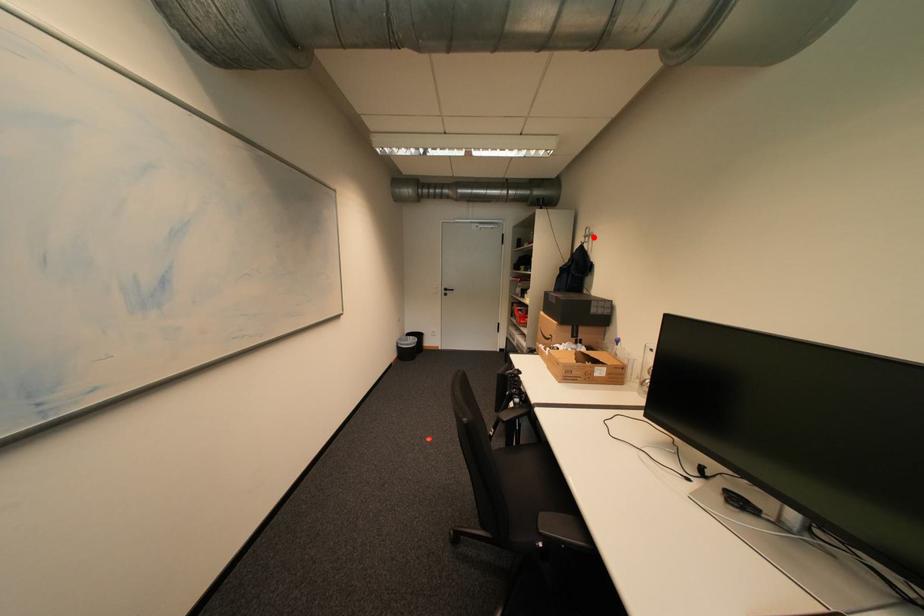
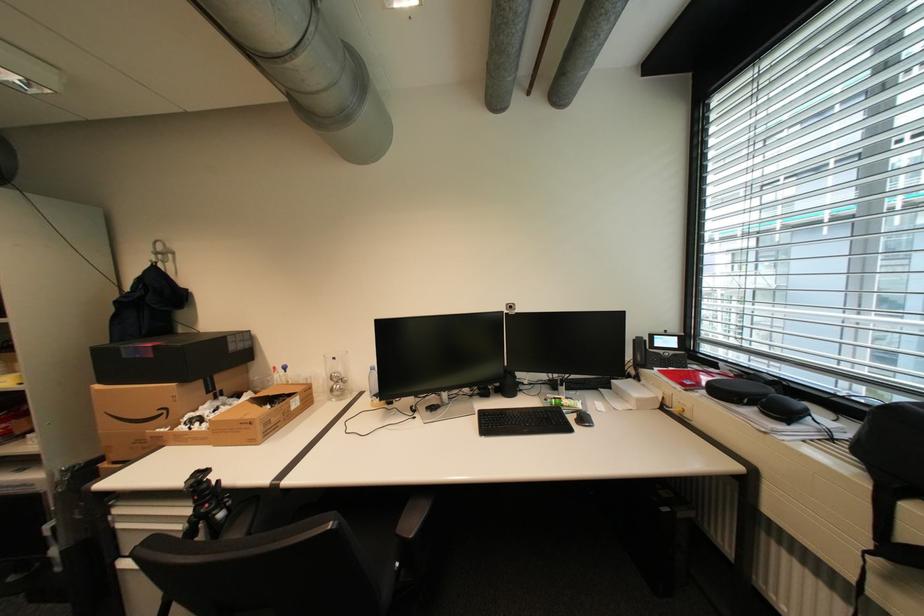
Question: I am providing you with two images of the same scene from different viewpoints. Image1 has a red point marked. In image2, the corresponding 3D location appears at what relative position? Reply with the corresponding letter.

Choices:
 (A) Closer
 (B) Farther

Answer: (B)